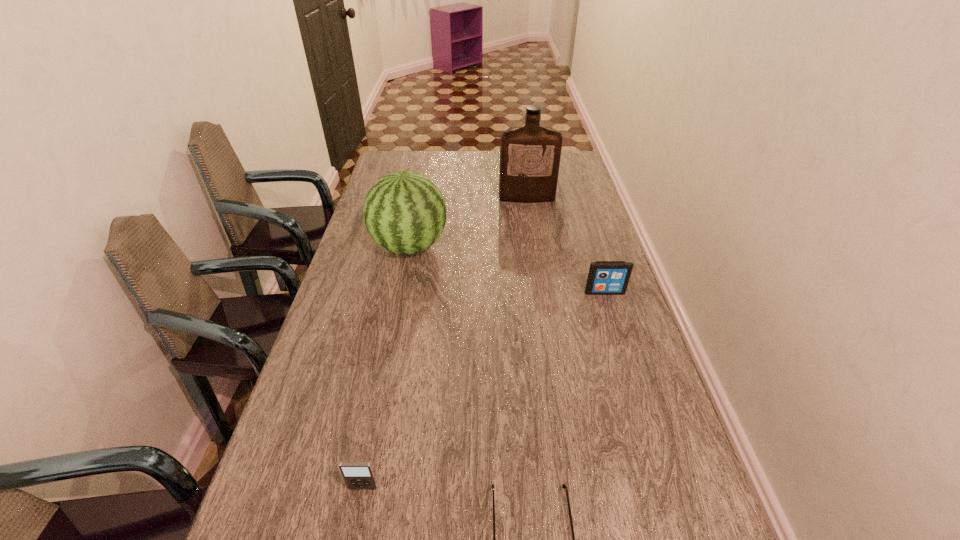
Where is `vacant area situated on the front screen of the rightmost object`? The image size is (960, 540). vacant area situated on the front screen of the rightmost object is located at coordinates (615, 327).

I want to click on free point located on the front-facing side of the second shortest object, so click(x=355, y=527).

Image resolution: width=960 pixels, height=540 pixels. Find the location of `object that is at the left edge`. object that is at the left edge is located at coordinates (404, 212).

You are a GUI agent. You are given a task and a screenshot of the screen. Output one action in this format:
    pyautogui.click(x=<x>, y=<y>)
    Task: Click on the liquor present at the right edge
    The width and height of the screenshot is (960, 540).
    Given the screenshot: What is the action you would take?
    pyautogui.click(x=530, y=155)

Locate an element on the screen. Image resolution: width=960 pixels, height=540 pixels. iPod located in the right edge section of the desktop is located at coordinates (605, 277).

This screenshot has height=540, width=960. Identify the location of vacant space at the far edge of the desktop. (426, 158).

The height and width of the screenshot is (540, 960). In order to click on free region at the left edge in this screenshot , I will do `click(347, 275)`.

In the image, there is a desktop. What are the coordinates of `vacant area at the right edge` in the screenshot? It's located at (633, 310).

The height and width of the screenshot is (540, 960). I want to click on unoccupied position between the tallest object and the right iPod, so pos(565,245).

This screenshot has height=540, width=960. I want to click on free space between the liquor and the shorter iPod, so click(445, 343).